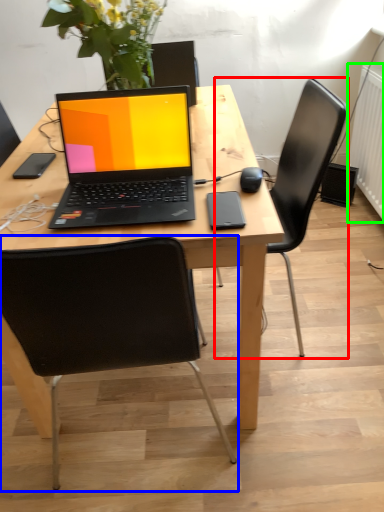
Question: Based on their relative distances, which object is farther from chair (highlighted by a red box)? Choose from chair (highlighted by a blue box) and radiator (highlighted by a green box).

Choices:
 (A) chair
 (B) radiator

Answer: (B)